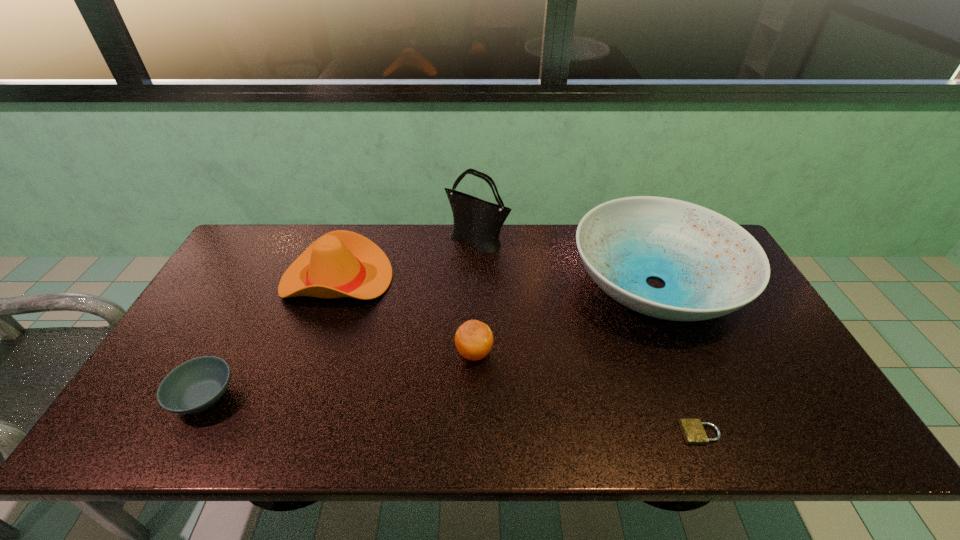
Find the location of a particular element. The image size is (960, 540). shoulder bag is located at coordinates (479, 222).

Identify the location of dish. (711, 266).

Identify the location of cowboy hat. Image resolution: width=960 pixels, height=540 pixels. (341, 263).

The width and height of the screenshot is (960, 540). What are the coordinates of `orange` in the screenshot? It's located at (473, 339).

Locate an element on the screen. The image size is (960, 540). soup bowl is located at coordinates (197, 384).

Identify the location of the shortest object. This screenshot has width=960, height=540. (693, 431).

You are a GUI agent. You are given a task and a screenshot of the screen. Output one action in this format:
    pyautogui.click(x=<x>, y=<y>)
    Task: Click on the vacant space located 0.200m on the right of the tallest object
    This screenshot has height=540, width=960.
    Given the screenshot: What is the action you would take?
    pyautogui.click(x=567, y=241)

Where is `blank space located on the front of the dish`? Image resolution: width=960 pixels, height=540 pixels. blank space located on the front of the dish is located at coordinates 718,428.

This screenshot has width=960, height=540. I want to click on blank space located 0.380m on the front of the cowboy hat, so click(x=281, y=433).

Locate an element on the screen. Image resolution: width=960 pixels, height=540 pixels. vacant region located on the left of the orange is located at coordinates (x=383, y=353).